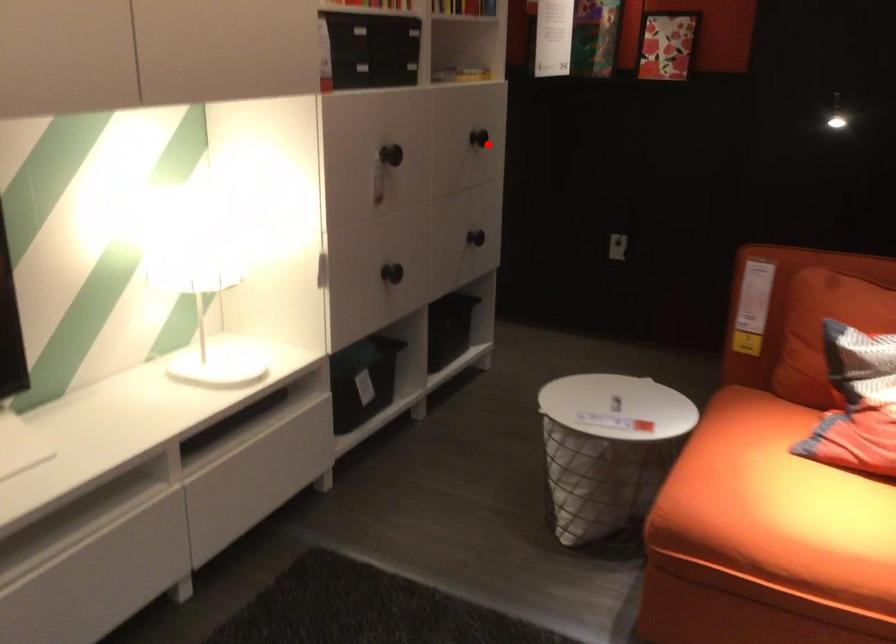
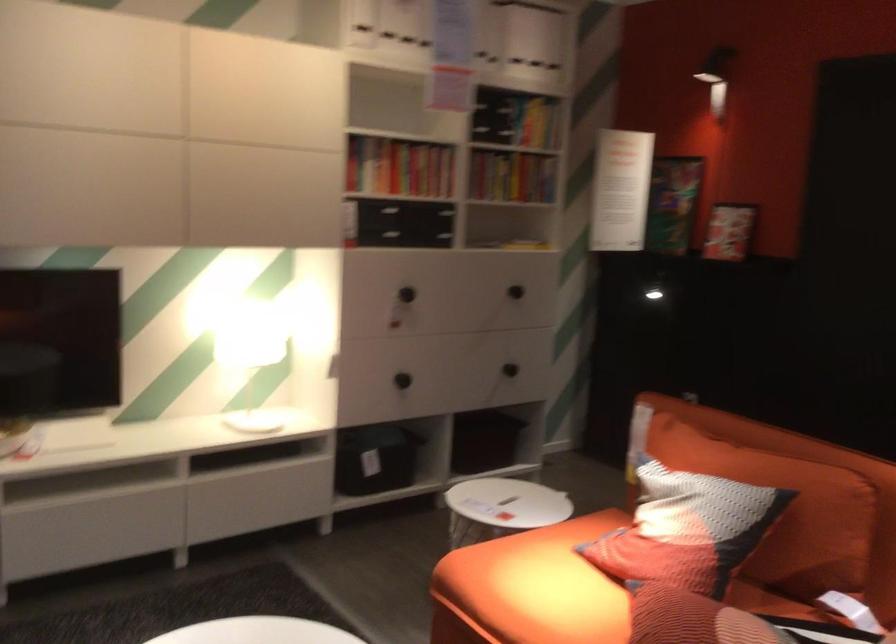
Question: I am providing you with two images of the same scene from different viewpoints. A red point is shown in image1. For the corresponding object point in image2, is it positioned nearer or farther from the camera?

Choices:
 (A) Nearer
 (B) Farther

Answer: (B)